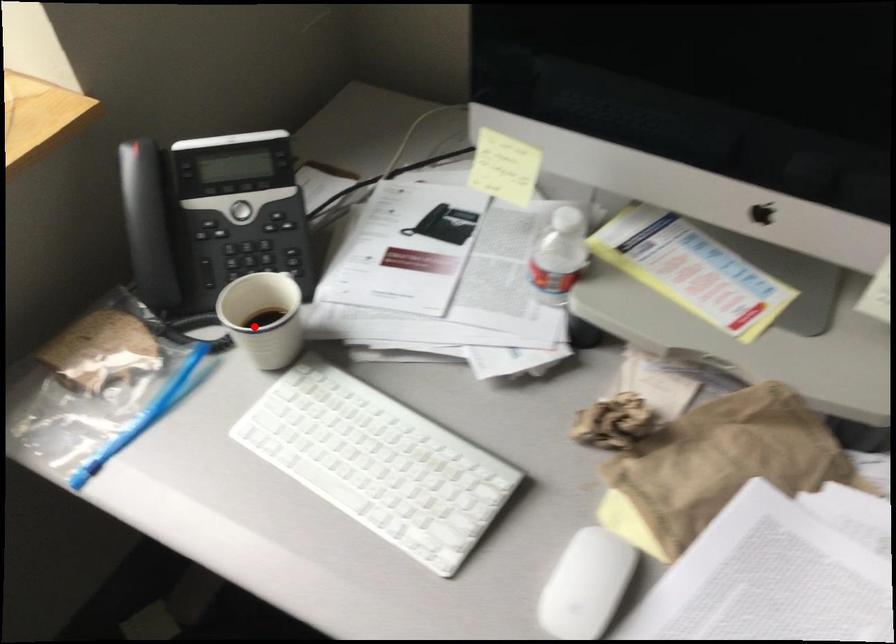
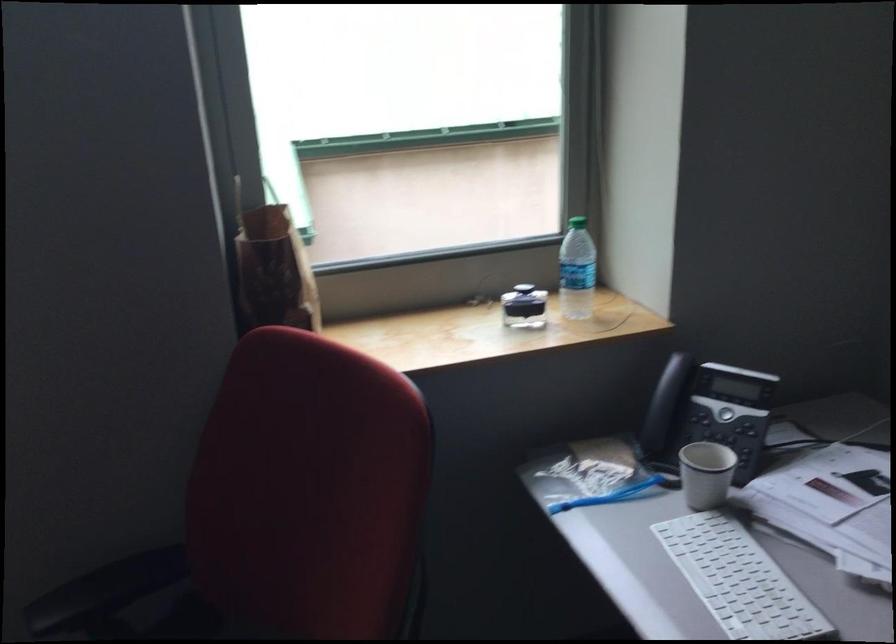
Where in the second image is the point corresponding to the highlighted location from the first image?

(705, 474)